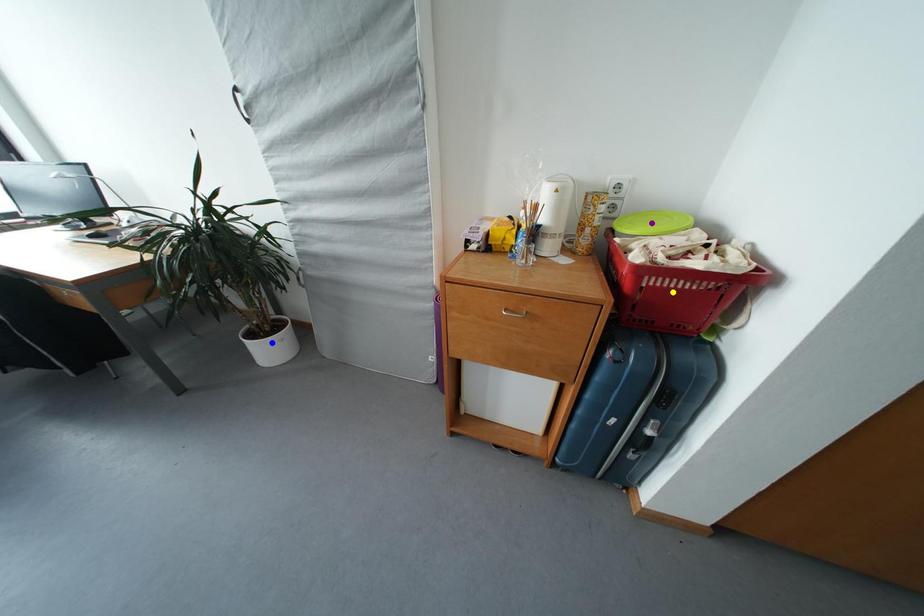
Order these from farthest to nearest:
A) yellow point
B) blue point
C) purple point

blue point → purple point → yellow point